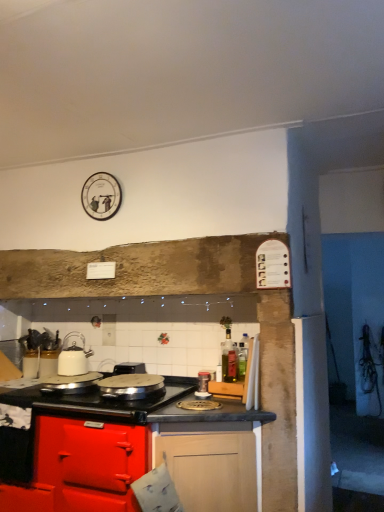
Question: Would you say green glass bottle at center is to the left or to the right of black plastic toaster at center in the picture?

Choices:
 (A) right
 (B) left

Answer: (A)

Question: Considering the positions of green glass bottle at center and black plastic toaster at center in the image, is green glass bottle at center wider or thinner than black plastic toaster at center?

Choices:
 (A) wide
 (B) thin

Answer: (B)

Question: Which of these objects is positioned closest to the metallic silver canister at center, which appears as the third kitchen appliance when viewed from the left?

Choices:
 (A) white glossy kettle at left, marked as the second kitchen appliance in a right-to-left arrangement
 (B) green glass bottle at center
 (C) shiny silver pan at center, the 1th kitchen appliance from the left
 (D) black plastic toaster at center
 (E) glossy wood cabinet at lower center

Answer: (B)

Question: Estimate the real-world distances between objects in this image. Which object is farther from the glossy wood cabinet at lower center?

Choices:
 (A) white glossy kettle at left, marked as the second kitchen appliance in a right-to-left arrangement
 (B) black plastic toaster at center
 (C) metallic silver canister at center, the 1th kitchen appliance from the right
 (D) green glass bottle at center
 (E) shiny silver pan at center, placed as the 3th kitchen appliance when sorted from right to left

Answer: (D)